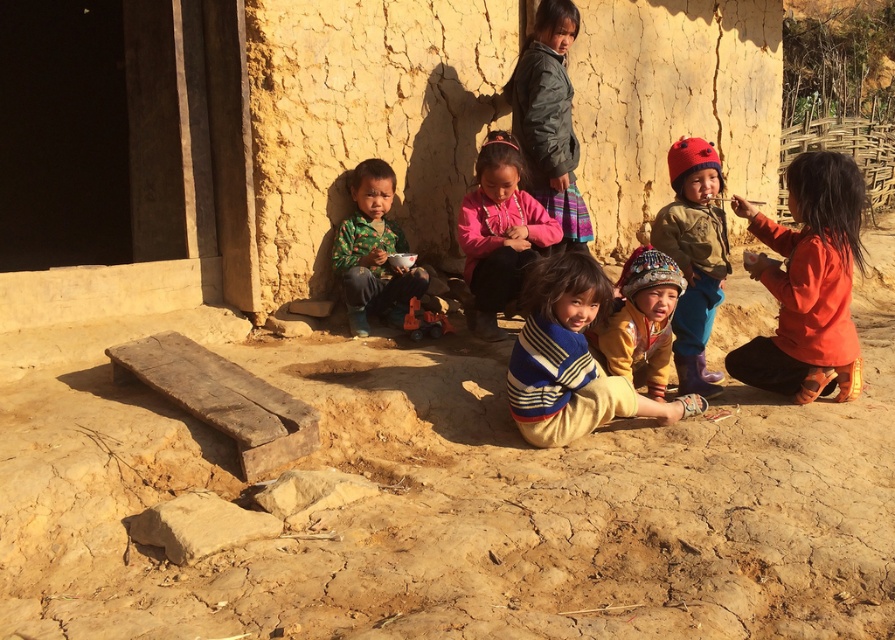
Question: Among these points, which one is farthest from the camera?

Choices:
 (A) (766, 224)
 (B) (495, 228)
 (C) (634, 314)

Answer: (B)

Question: Can you confirm if brown rough stone at lower left is smaller than brown rough stone at center?

Choices:
 (A) yes
 (B) no

Answer: (B)

Question: Does striped sweater at center lie in front of pink fleece jacket at center?

Choices:
 (A) yes
 (B) no

Answer: (A)

Question: Where is striped sweater at center located in relation to brown rough stone at lower left in the image?

Choices:
 (A) below
 (B) above

Answer: (B)

Question: Among these objects, which one is nearest to the camera?

Choices:
 (A) knitted woolen hat at center
 (B) striped sweater at center
 (C) orange cotton shirt at right
 (D) brown rough stone at lower left

Answer: (D)

Question: Which point is farther to the camera?

Choices:
 (A) (766, 230)
 (B) (266, 509)
 (C) (493, 177)

Answer: (C)